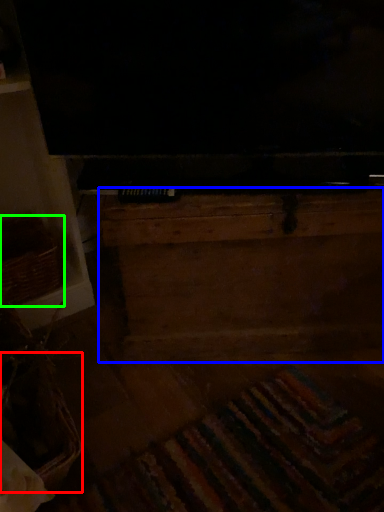
Question: Estimate the real-world distances between objects in this image. Which object is farther from basket (highlighted by a red box), dresser (highlighted by a blue box) or basket (highlighted by a green box)?

Choices:
 (A) dresser
 (B) basket

Answer: (A)